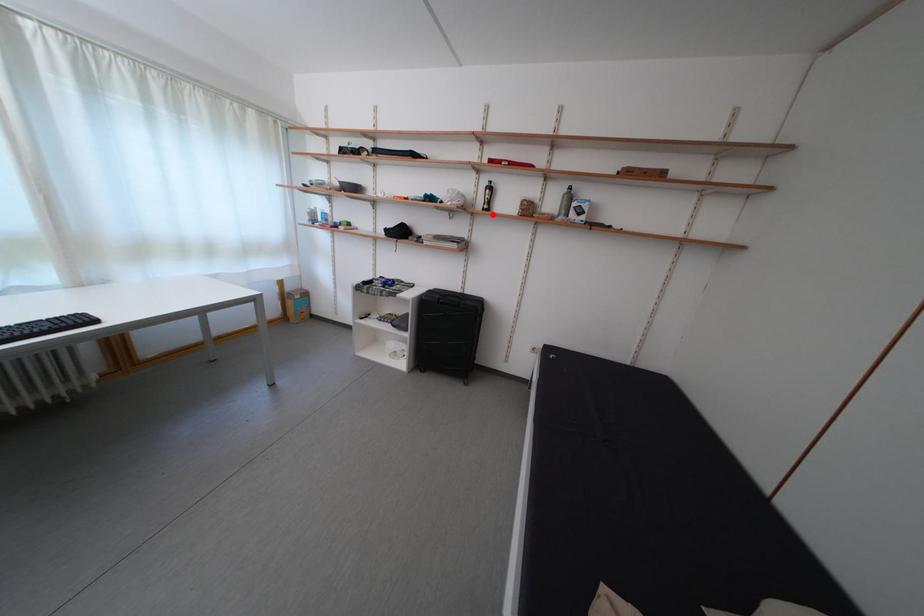
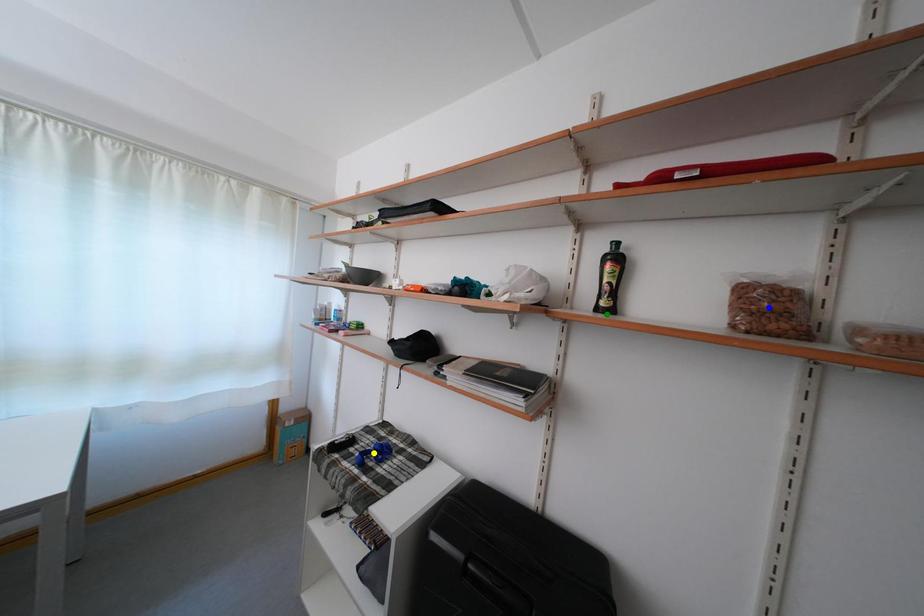
Question: I am providing you with two images of the same scene from different viewpoints. A red point is marked on the first image. You are given multiple points on the second image. Which spot in image 2 lines up with the point in image 1?

Choices:
 (A) blue point
 (B) yellow point
 (C) green point

Answer: (C)